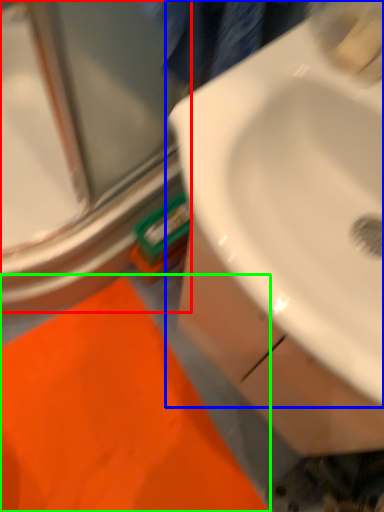
Question: Which object is positioned farthest from glass door (highlighted by a red box)? Select from sink (highlighted by a blue box) and bath mat (highlighted by a green box).

Choices:
 (A) sink
 (B) bath mat

Answer: (A)